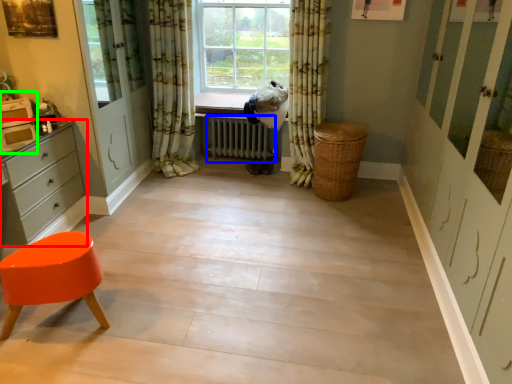
Question: Which object is positioned farthest from chest of drawers (highlighted by a red box)? Select from radiator (highlighted by a blue box) and appliance (highlighted by a green box).

Choices:
 (A) radiator
 (B) appliance

Answer: (A)